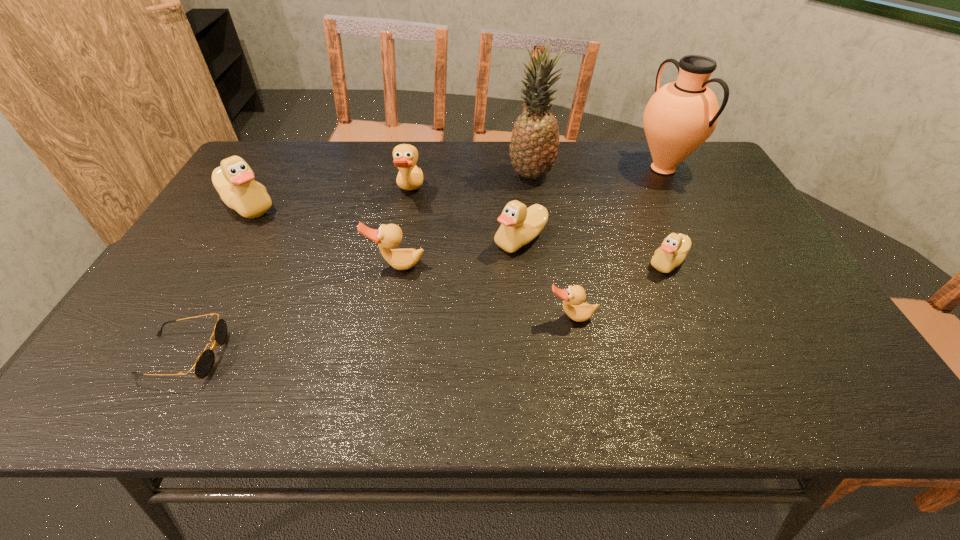
Where is `free area in between the biggest tan duck and the second biggest tan duck`? free area in between the biggest tan duck and the second biggest tan duck is located at coordinates (403, 229).

Where is `vacant space that's between the second beige duck from left to right and the farthest tan duck`? This screenshot has height=540, width=960. vacant space that's between the second beige duck from left to right and the farthest tan duck is located at coordinates (466, 216).

Identify which object is the eighth nearest to the second tallest object. Please provide its 2D coordinates. Your answer should be formatted as a tuple, i.e. [(x, y)], where the tuple contains the x and y coordinates of a point satisfying the conditions above.

[(204, 364)]

Locate which object ranks fifth in proximity to the second biggest beige duck. Please provide its 2D coordinates. Your answer should be formatted as a tuple, i.e. [(x, y)], where the tuple contains the x and y coordinates of a point satisfying the conditions above.

[(672, 252)]

Locate an element on the screen. The width and height of the screenshot is (960, 540). the fifth closest duck relative to the farthest tan duck is located at coordinates (672, 252).

Point out which duck is positioned as the sixth nearest to the pineapple. Please provide its 2D coordinates. Your answer should be formatted as a tuple, i.e. [(x, y)], where the tuple contains the x and y coordinates of a point satisfying the conditions above.

[(234, 180)]

At what (x,y) coordinates should I click in order to perform the action: click on beige duck that is the third closest to the biggest tan duck. Please return your answer as a coordinate pair (x, y). This screenshot has width=960, height=540. Looking at the image, I should click on (672, 252).

Identify which beige duck is the nearest to the second beige duck from left to right. Please provide its 2D coordinates. Your answer should be formatted as a tuple, i.e. [(x, y)], where the tuple contains the x and y coordinates of a point satisfying the conditions above.

[(672, 252)]

Select which tan duck appears as the second closest to the second nearest object. Please provide its 2D coordinates. Your answer should be formatted as a tuple, i.e. [(x, y)], where the tuple contains the x and y coordinates of a point satisfying the conditions above.

[(410, 177)]

Select which tan duck is the closest to the sunglasses. Please provide its 2D coordinates. Your answer should be formatted as a tuple, i.e. [(x, y)], where the tuple contains the x and y coordinates of a point satisfying the conditions above.

[(389, 236)]